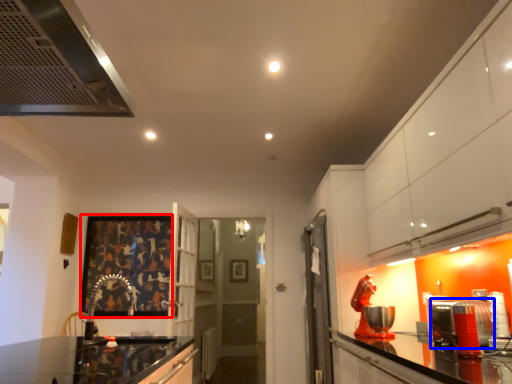
Question: Among these objects, which one is nearest to the camera, picture frame (highlighted by a red box) or appliance (highlighted by a blue box)?

Choices:
 (A) picture frame
 (B) appliance

Answer: (B)